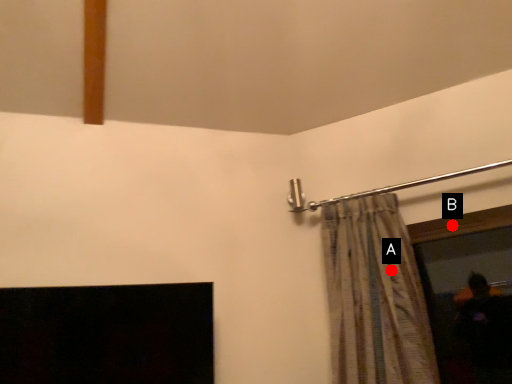
Question: Two points are circled on the image, labeled by A and B beside each circle. Which point is further to the camera?

Choices:
 (A) A is further
 (B) B is further

Answer: (B)